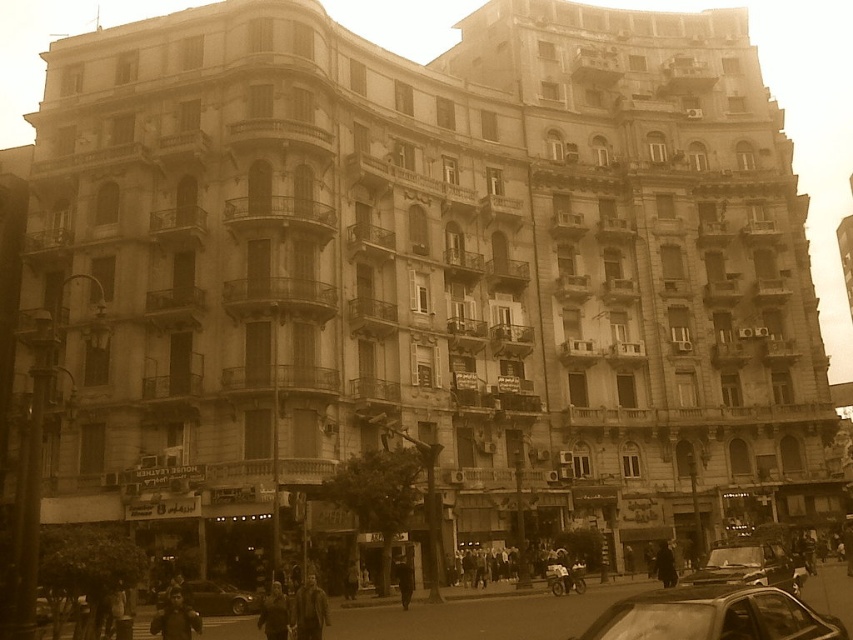
Can you confirm if metallic silver car at lower right is positioned to the right of metallic silver car at center?

Indeed, metallic silver car at lower right is positioned on the right side of metallic silver car at center.

Does point (840, 634) lie in front of point (183, 593)?

Yes, it is in front of point (183, 593).

Measure the distance between metallic silver car at lower right and camera.

The distance of metallic silver car at lower right from camera is 28.47 meters.

Image resolution: width=853 pixels, height=640 pixels. What are the coordinates of `metallic silver car at lower right` in the screenshot? It's located at (712, 616).

Does metallic car at center appear under metallic silver car at center?

No, metallic car at center is not below metallic silver car at center.

Does metallic car at center appear on the left side of metallic silver car at center?

No, metallic car at center is not to the left of metallic silver car at center.

Does point (766, 577) come closer to viewer compared to point (219, 612)?

Yes, point (766, 577) is in front of point (219, 612).

Where is `metallic car at center`? This screenshot has width=853, height=640. metallic car at center is located at coordinates (746, 564).

Who is lower down, metallic silver car at lower right or metallic car at center?

metallic car at center is lower down.

Where is `metallic silver car at lower right`? metallic silver car at lower right is located at coordinates (712, 616).

Is point (686, 602) more distant than point (776, 548)?

That is False.

At what (x,y) coordinates should I click in order to perform the action: click on metallic silver car at lower right. Please return your answer as a coordinate pair (x, y). This screenshot has height=640, width=853. Looking at the image, I should click on (712, 616).